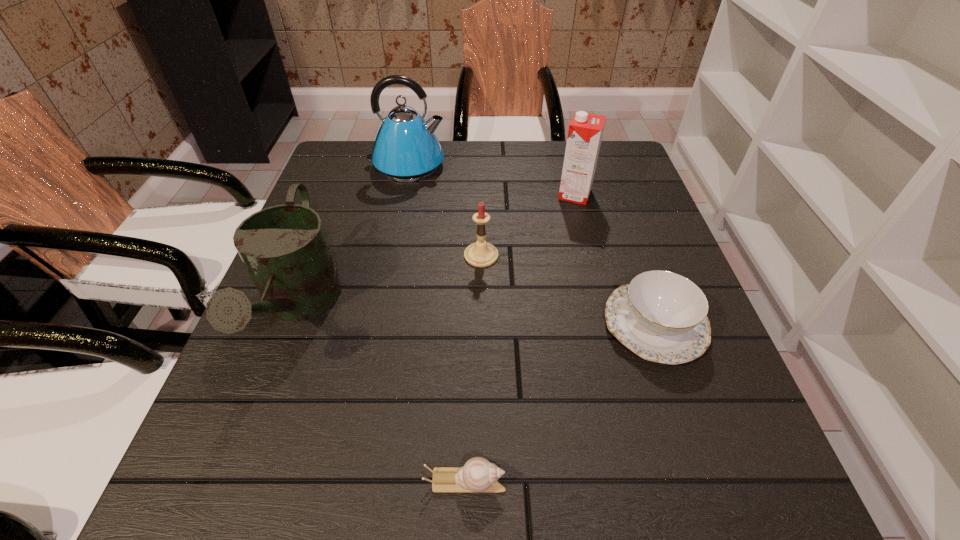
Locate an element on the screen. Image resolution: width=960 pixels, height=540 pixels. vacant space that satisfies the following two spatial constraints: 1. on the back side of the carton; 2. at the spout of the kettle is located at coordinates (567, 165).

Where is `vacant space that satisfies the following two spatial constraints: 1. at the spout of the kettle; 2. on the left side of the carton`? This screenshot has height=540, width=960. vacant space that satisfies the following two spatial constraints: 1. at the spout of the kettle; 2. on the left side of the carton is located at coordinates (400, 194).

I want to click on vacant point that satisfies the following two spatial constraints: 1. at the spout of the candle; 2. on the left side of the kettle, so click(388, 255).

This screenshot has height=540, width=960. Find the location of `vacant area in the image that satisfies the following two spatial constraints: 1. at the spout of the third shortest object; 2. on the right side of the kettle`. vacant area in the image that satisfies the following two spatial constraints: 1. at the spout of the third shortest object; 2. on the right side of the kettle is located at coordinates pyautogui.click(x=388, y=255).